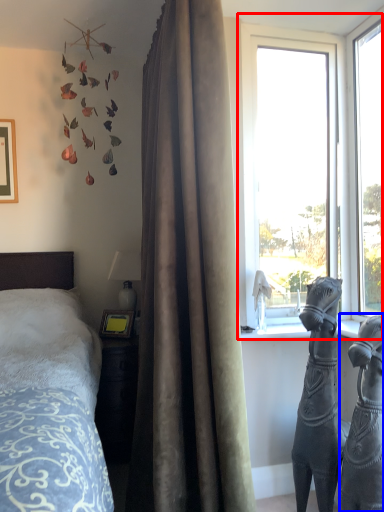
Question: Among these objects, which one is farthest to the camera, window (highlighted by a red box) or sculpture (highlighted by a blue box)?

Choices:
 (A) window
 (B) sculpture

Answer: (A)